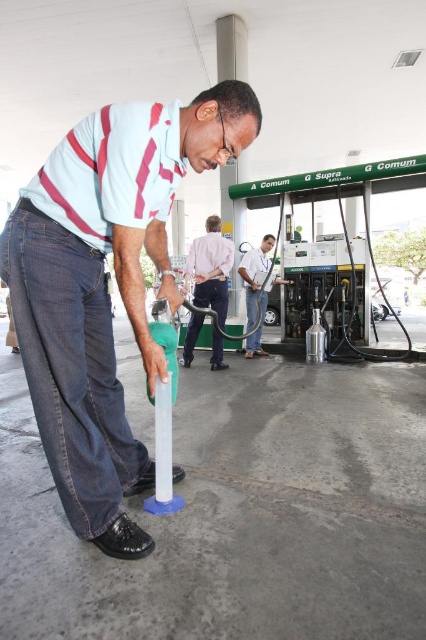
You are a customer at the gas station and need to fill your portable fuel tank. You see the pink cotton shirt at center and the white glossy fuel nozzle at center. Which object should you interact with to fill your tank?

You should interact with the white glossy fuel nozzle at center because it is the fuel pump nozzle connected to the fuel source, while the pink cotton shirt at center belongs to another person and is not related to filling the tank.